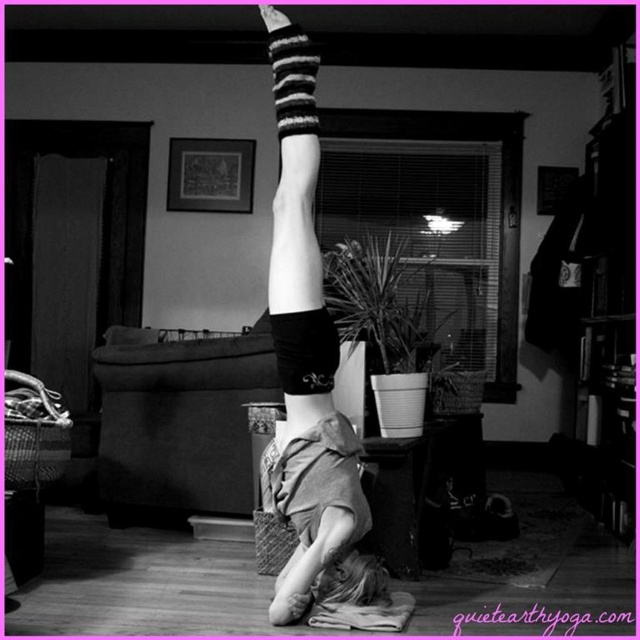
You are a photographer trying to capture the perfect shot of the gymnast. You notice the smooth skin gymnast at center and the black striped sock at upper center. Which object should you focus on if you want to ensure the widest subject in the frame is sharp?

The smooth skin gymnast at center should be focused on because it might be wider than the black striped sock at upper center, ensuring the widest subject is sharp.

You are a photographer adjusting lighting for a photo shoot in the living room. You need to ensure both the smooth skin gymnast at center and the black striped sock at upper center are well lit. Based on their sizes, which object requires a wider light source to cover it properly?

The smooth skin gymnast at center requires a wider light source because it is taller than the black striped sock at upper center.